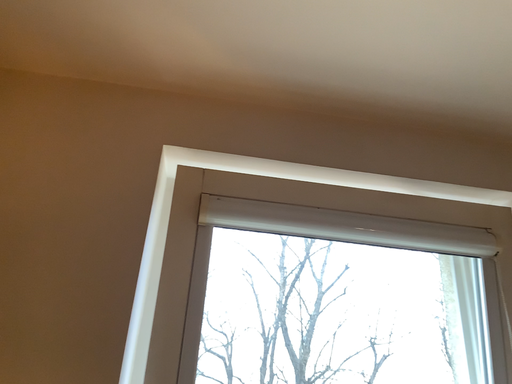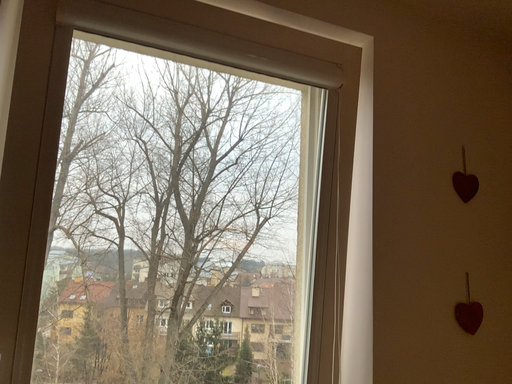
Question: Which way did the camera rotate in the video?

Choices:
 (A) rotated left
 (B) rotated right

Answer: (B)